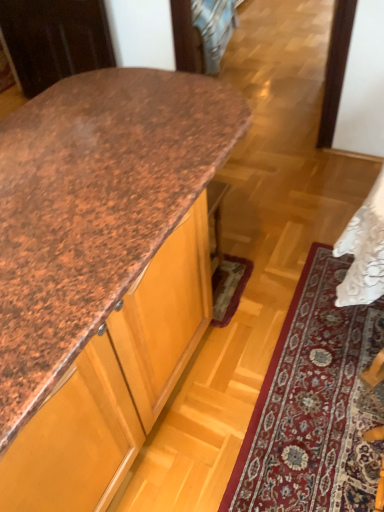
Question: From a real-world perspective, is brown speckled laminate countertop at upper left above or below carpet with intricate patterns at lower right?

Choices:
 (A) above
 (B) below

Answer: (A)

Question: Considering the positions of brown speckled laminate countertop at upper left and carpet with intricate patterns at lower right in the image, is brown speckled laminate countertop at upper left taller or shorter than carpet with intricate patterns at lower right?

Choices:
 (A) short
 (B) tall

Answer: (B)

Question: Based on their sizes in the image, would you say brown speckled laminate countertop at upper left is bigger or smaller than carpet with intricate patterns at lower right?

Choices:
 (A) small
 (B) big

Answer: (B)

Question: From the image's perspective, relative to brown speckled laminate countertop at upper left, is carpet with intricate patterns at lower right above or below?

Choices:
 (A) above
 (B) below

Answer: (B)

Question: Is carpet with intricate patterns at lower right in front of or behind brown speckled laminate countertop at upper left in the image?

Choices:
 (A) behind
 (B) front

Answer: (A)

Question: Considering the positions of carpet with intricate patterns at lower right and brown speckled laminate countertop at upper left in the image, is carpet with intricate patterns at lower right taller or shorter than brown speckled laminate countertop at upper left?

Choices:
 (A) tall
 (B) short

Answer: (B)

Question: Considering the relative positions of carpet with intricate patterns at lower right and brown speckled laminate countertop at upper left in the image provided, is carpet with intricate patterns at lower right to the left or to the right of brown speckled laminate countertop at upper left?

Choices:
 (A) right
 (B) left

Answer: (A)